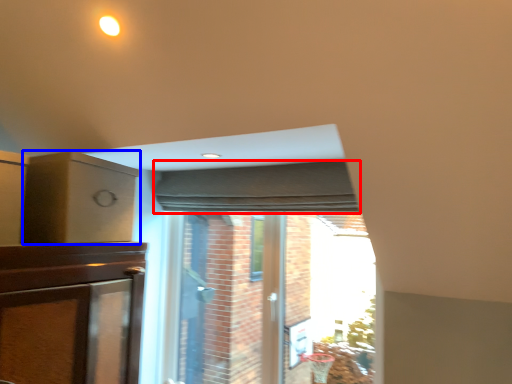
Question: Among these objects, which one is nearest to the camera, curtain (highlighted by a red box) or cabinetry (highlighted by a blue box)?

Choices:
 (A) curtain
 (B) cabinetry

Answer: (B)